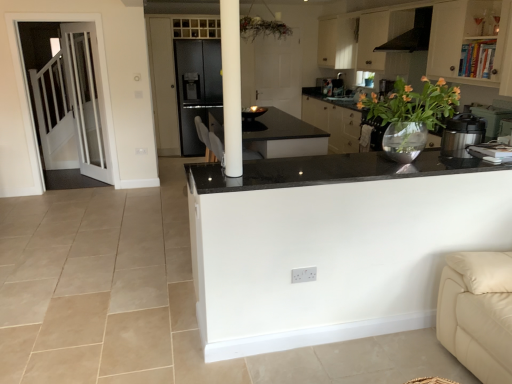
Question: Is black matte exhaust hood at upper right to the right of metallic silver pressure cooker at right from the viewer's perspective?

Choices:
 (A) no
 (B) yes

Answer: (B)

Question: Does black matte exhaust hood at upper right come behind metallic silver pressure cooker at right?

Choices:
 (A) yes
 (B) no

Answer: (A)

Question: From the image's perspective, is black matte exhaust hood at upper right located beneath metallic silver pressure cooker at right?

Choices:
 (A) no
 (B) yes

Answer: (A)

Question: Could you tell me if black matte exhaust hood at upper right is facing metallic silver pressure cooker at right?

Choices:
 (A) no
 (B) yes

Answer: (A)

Question: Does black matte exhaust hood at upper right appear on the left side of metallic silver pressure cooker at right?

Choices:
 (A) yes
 (B) no

Answer: (B)

Question: From a real-world perspective, is black granite countertop at center physically located above or below white glass door at left?

Choices:
 (A) below
 (B) above

Answer: (B)

Question: Is black granite countertop at center bigger or smaller than white glass door at left?

Choices:
 (A) big
 (B) small

Answer: (B)

Question: From the image's perspective, is black granite countertop at center above or below white glass door at left?

Choices:
 (A) below
 (B) above

Answer: (A)

Question: Relative to white glass door at left, is black granite countertop at center in front or behind?

Choices:
 (A) behind
 (B) front

Answer: (B)

Question: Based on their sizes in the image, would you say black granite countertop at center is bigger or smaller than translucent glass vase at upper right?

Choices:
 (A) small
 (B) big

Answer: (A)

Question: From a real-world perspective, is black granite countertop at center physically located above or below translucent glass vase at upper right?

Choices:
 (A) below
 (B) above

Answer: (A)

Question: Considering the relative positions of black granite countertop at center and translucent glass vase at upper right in the image provided, is black granite countertop at center to the left or to the right of translucent glass vase at upper right?

Choices:
 (A) right
 (B) left

Answer: (B)

Question: Does point (437, 165) appear closer or farther from the camera than point (408, 100)?

Choices:
 (A) closer
 (B) farther

Answer: (B)

Question: Do you think white matte cabinet at upper right is within metallic silver pressure cooker at right, or outside of it?

Choices:
 (A) inside
 (B) outside

Answer: (B)

Question: Considering the positions of white matte cabinet at upper right and metallic silver pressure cooker at right in the image, is white matte cabinet at upper right taller or shorter than metallic silver pressure cooker at right?

Choices:
 (A) short
 (B) tall

Answer: (B)